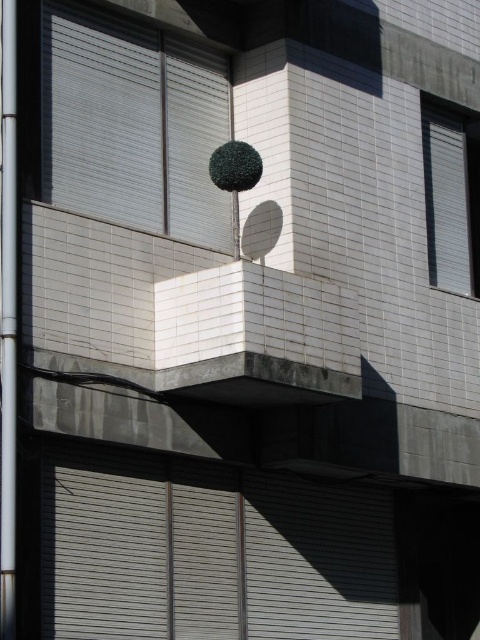
You are an architect designing a new building inspired by this scene. You need to decide whether to prioritize space for the metallic pole at left or the white matte window at upper right. Based on their sizes, which should you allocate more space to?

The white matte window at upper right requires more space since the metallic pole at left occupies less space than it.

You are an architect designing a new building and want to ensure that the metallic pole at left and the white matte window at upper right are proportionally balanced. Which object has a smaller width?

The metallic pole at left is thinner than the white matte window at upper right, so the metallic pole at left has a smaller width.

You are standing at point (54, 44) and want to reach the spherical topiary plant on the balcony. The minimum distance you can move in one step is 120 feet. Can you reach the plant in a single step?

The distance between you and the spherical topiary plant is 117.77 feet, which is less than your minimum step distance of 120 feet. Therefore, you can reach the plant in a single step.